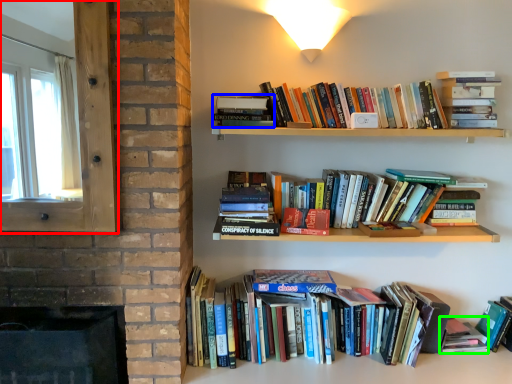
Question: Which object is positioned closest to window screen (highlighted by a red box)? Select from book (highlighted by a blue box) and paperback book (highlighted by a green box).

Choices:
 (A) book
 (B) paperback book

Answer: (A)